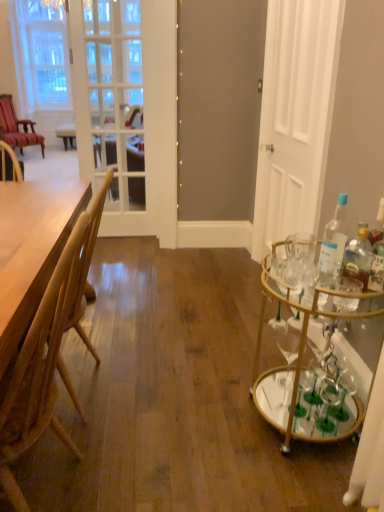
Question: Does wooden table at left turn towards velvet red armchair at left, positioned as the 1th chair in left-to-right order?

Choices:
 (A) yes
 (B) no

Answer: (B)

Question: Considering the relative sizes of wooden table at left and velvet red armchair at left, marked as the 2th chair in a bottom-to-top arrangement, in the image provided, is wooden table at left shorter than velvet red armchair at left, marked as the 2th chair in a bottom-to-top arrangement,?

Choices:
 (A) no
 (B) yes

Answer: (B)

Question: From a real-world perspective, is wooden table at left under velvet red armchair at left, which is counted as the 1th chair, starting from the back?

Choices:
 (A) yes
 (B) no

Answer: (A)

Question: Is wooden table at left placed right next to velvet red armchair at left, acting as the second chair starting from the right?

Choices:
 (A) no
 (B) yes

Answer: (A)

Question: From a real-world perspective, is wooden table at left positioned over velvet red armchair at left, which is counted as the 1th chair, starting from the back, based on gravity?

Choices:
 (A) yes
 (B) no

Answer: (B)

Question: From the image's perspective, is wooden table at left over velvet red armchair at left, marked as the 2th chair in a bottom-to-top arrangement?

Choices:
 (A) yes
 (B) no

Answer: (B)

Question: Can you confirm if white glass screen door at upper left is bigger than light brown wood chair at left, which is the 1th chair from bottom to top?

Choices:
 (A) no
 (B) yes

Answer: (A)

Question: Is white glass screen door at upper left closer to camera compared to light brown wood chair at left, marked as the first chair in a right-to-left arrangement?

Choices:
 (A) yes
 (B) no

Answer: (B)

Question: Is white glass screen door at upper left facing towards light brown wood chair at left, marked as the 2th chair in a left-to-right arrangement?

Choices:
 (A) yes
 (B) no

Answer: (A)

Question: Is light brown wood chair at left, which is the 1th chair from bottom to top, inside white glass screen door at upper left?

Choices:
 (A) no
 (B) yes

Answer: (A)

Question: Considering the relative positions of white glass screen door at upper left and light brown wood chair at left, which appears as the second chair when viewed from the top, in the image provided, is white glass screen door at upper left behind light brown wood chair at left, which appears as the second chair when viewed from the top,?

Choices:
 (A) yes
 (B) no

Answer: (A)

Question: Considering the relative sizes of white glass screen door at upper left and light brown wood chair at left, which appears as the second chair when viewed from the top, in the image provided, is white glass screen door at upper left wider than light brown wood chair at left, which appears as the second chair when viewed from the top,?

Choices:
 (A) yes
 (B) no

Answer: (B)

Question: From a real-world perspective, is gold mirrored bar cart at right on wooden table at left?

Choices:
 (A) no
 (B) yes

Answer: (A)